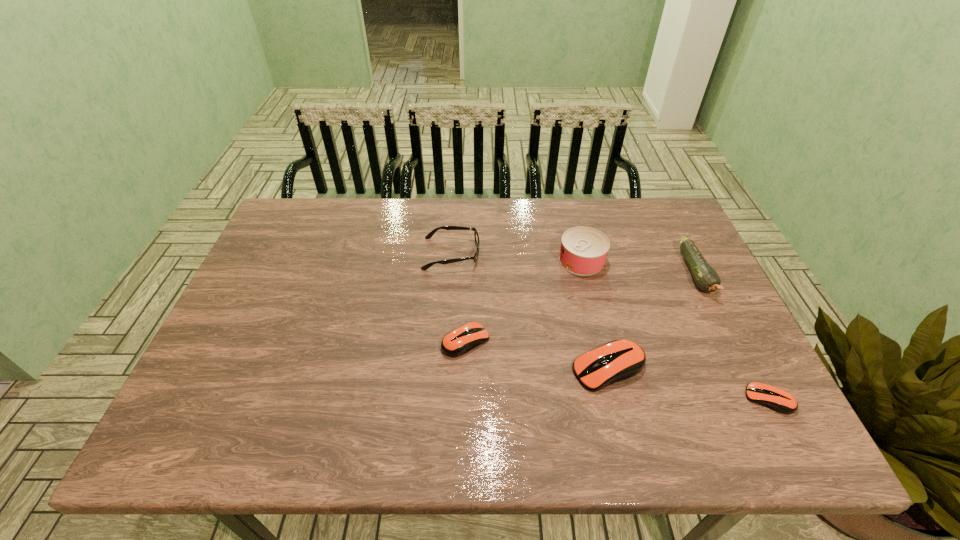
Find the location of a particular element. free point between the shortest computer mouse and the spectacles is located at coordinates (610, 327).

This screenshot has height=540, width=960. Identify the location of vacant space that is in between the spectacles and the tallest computer mouse. (530, 311).

Where is `empty location between the spectacles and the second computer mouse from left to right`? The image size is (960, 540). empty location between the spectacles and the second computer mouse from left to right is located at coordinates (530, 311).

The image size is (960, 540). I want to click on vacant point located between the spectacles and the second shortest object, so click(459, 298).

Identify which object is the fifth nearest to the leftmost computer mouse. Please provide its 2D coordinates. Your answer should be formatted as a tuple, i.e. [(x, y)], where the tuple contains the x and y coordinates of a point satisfying the conditions above.

[(776, 399)]

Select which object is the third closest to the zucchini. Please provide its 2D coordinates. Your answer should be formatted as a tuple, i.e. [(x, y)], where the tuple contains the x and y coordinates of a point satisfying the conditions above.

[(776, 399)]

Image resolution: width=960 pixels, height=540 pixels. Identify the location of computer mouse that stands as the third closest to the tallest object. (776, 399).

Locate which computer mouse ranks second in proximity to the can. Please provide its 2D coordinates. Your answer should be formatted as a tuple, i.e. [(x, y)], where the tuple contains the x and y coordinates of a point satisfying the conditions above.

[(461, 340)]

Locate an element on the screen. This screenshot has width=960, height=540. vacant area in the image that satisfies the following two spatial constraints: 1. on the front-facing side of the tallest computer mouse; 2. on the left side of the spectacles is located at coordinates (444, 369).

The width and height of the screenshot is (960, 540). Identify the location of free location that satisfies the following two spatial constraints: 1. on the back side of the can; 2. on the front-facing side of the spectacles. (580, 254).